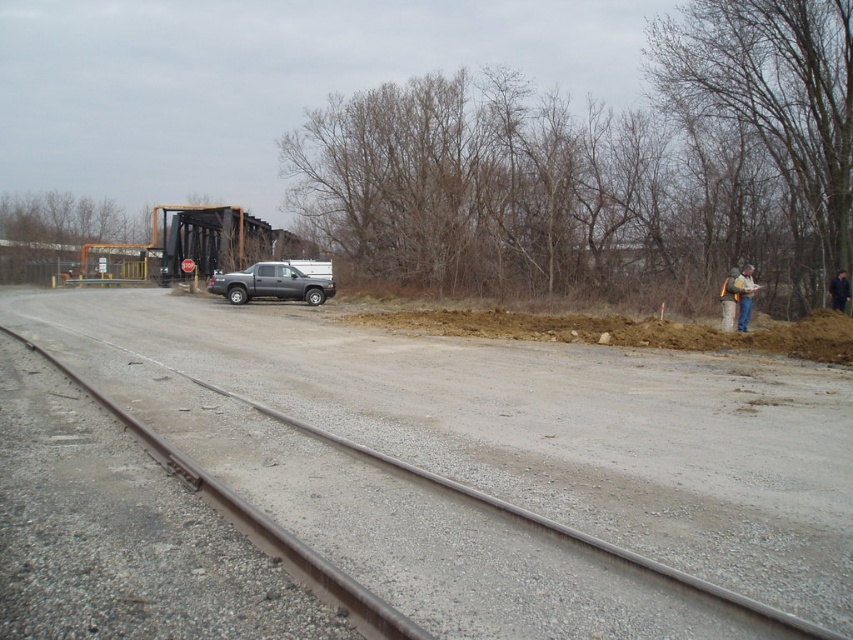
Question: Which point is closer to the camera taking this photo?

Choices:
 (A) (494, 500)
 (B) (755, 289)
 (C) (311, 305)

Answer: (A)

Question: Which point is closer to the camera?

Choices:
 (A) (276, 545)
 (B) (751, 273)

Answer: (A)

Question: Can you confirm if rusty metal track at center is positioned to the right of blue jeans at right?

Choices:
 (A) yes
 (B) no

Answer: (B)

Question: Is rusty metal track at center below blue jeans at right?

Choices:
 (A) yes
 (B) no

Answer: (A)

Question: Which object appears closest to the camera in this image?

Choices:
 (A) rusty metal track at center
 (B) blue jeans at right
 (C) gray metallic truck at center

Answer: (A)

Question: Can you confirm if gray metallic truck at center is smaller than blue jeans at right?

Choices:
 (A) no
 (B) yes

Answer: (A)